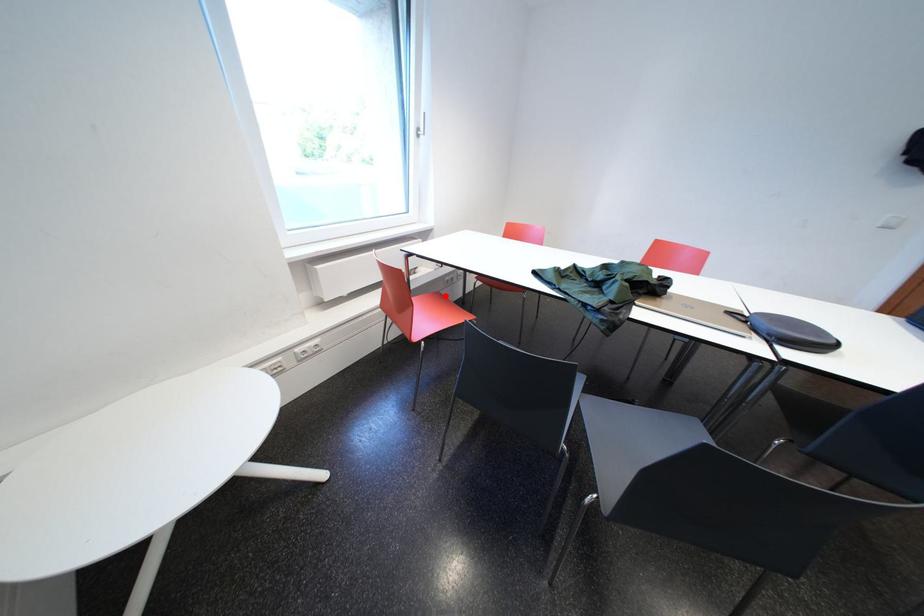
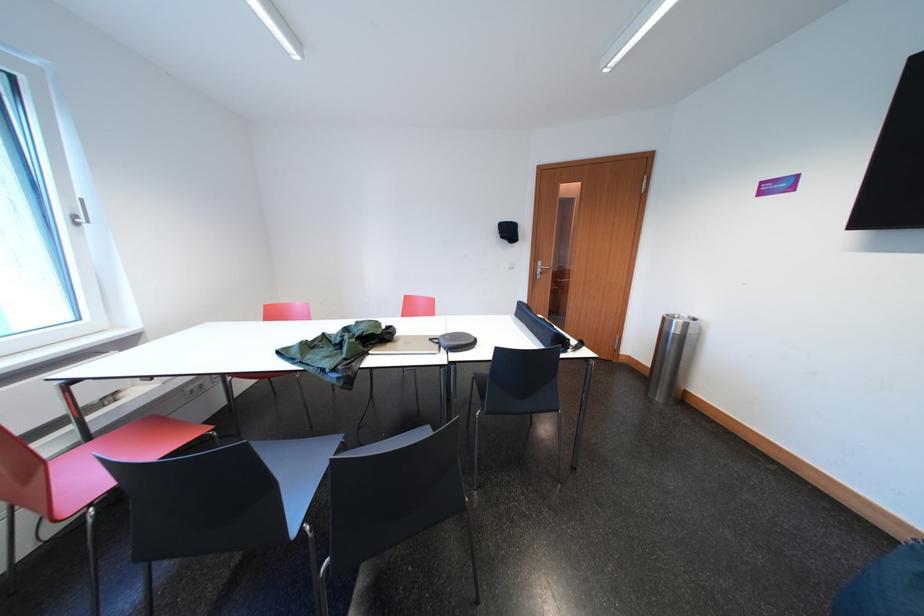
Find the pixel in the second image that matches the highlighted location in the first image.

(161, 419)